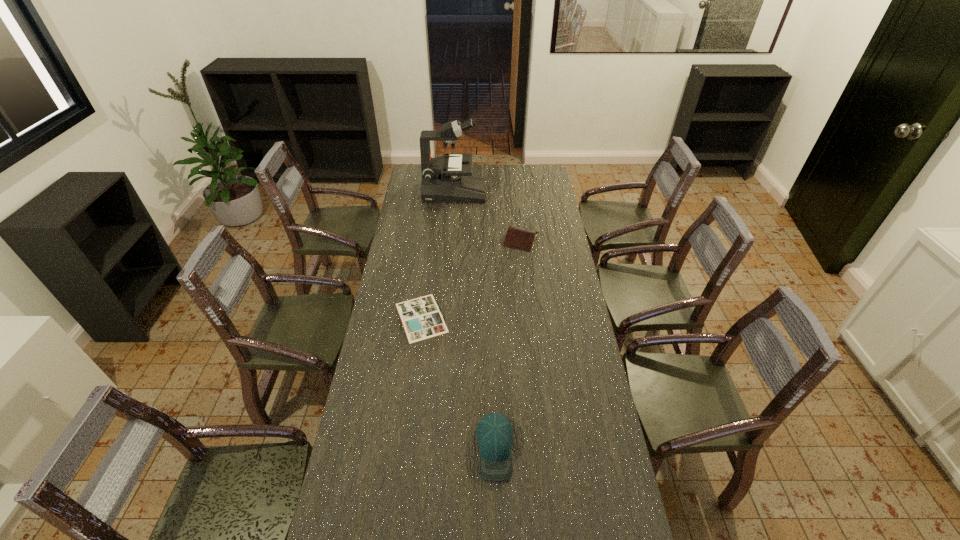
Identify the location of the farthest object. (447, 178).

At what (x,y) coordinates should I click in order to perform the action: click on microscope. Please return your answer as a coordinate pair (x, y). Looking at the image, I should click on (447, 178).

Where is `the third shortest object`? The image size is (960, 540). the third shortest object is located at coordinates (494, 433).

Where is `the nearest object`? This screenshot has width=960, height=540. the nearest object is located at coordinates (494, 433).

Find the location of a particular element. Image resolution: width=960 pixels, height=540 pixels. the rightmost object is located at coordinates (517, 237).

Identify the location of the taller book. The image size is (960, 540). (517, 237).

You are a GUI agent. You are given a task and a screenshot of the screen. Output one action in this format:
    pyautogui.click(x=<x>, y=<y>)
    Task: Click on the second nearest object
    The image size is (960, 540).
    Given the screenshot: What is the action you would take?
    pyautogui.click(x=421, y=318)

Where is `the nearer book`? The height and width of the screenshot is (540, 960). the nearer book is located at coordinates (421, 318).

Locate an element on the screen. free space located 0.080m through the eyepieces of the microscope is located at coordinates (499, 193).

At what (x,y) coordinates should I click in order to perform the action: click on vacant position located 0.210m on the back of the baseball cap. Please return your answer as a coordinate pair (x, y). The image size is (960, 540). Looking at the image, I should click on (492, 364).